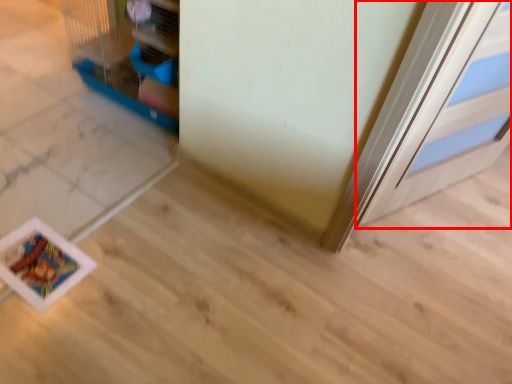
Question: From the image's perspective, where is door (annotated by the red box) located in relation to bird cage in the image?

Choices:
 (A) above
 (B) below

Answer: (B)